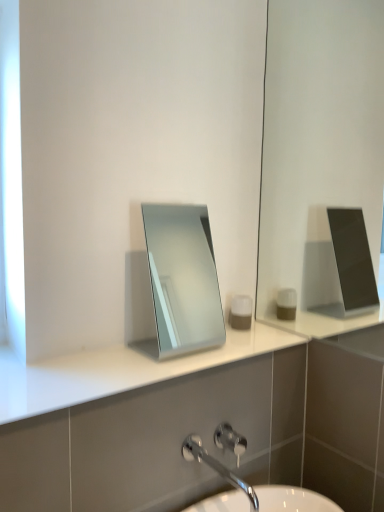
Where is `vacant space to the right of matte gray container at center`? Image resolution: width=384 pixels, height=512 pixels. vacant space to the right of matte gray container at center is located at coordinates (269, 333).